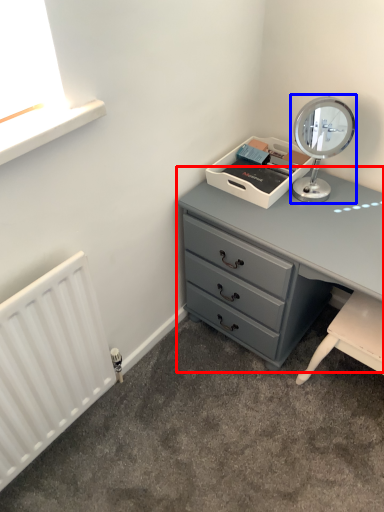
Question: Which object appears farthest to the camera in this image, chest of drawers (highlighted by a red box) or table lamp (highlighted by a blue box)?

Choices:
 (A) chest of drawers
 (B) table lamp

Answer: (B)